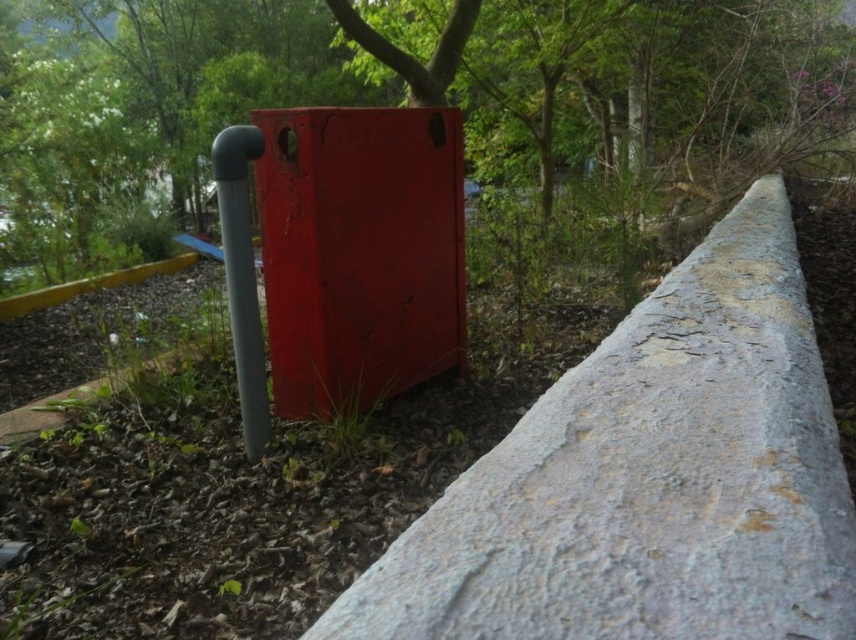
Question: Which of these objects is positioned farthest from the matte gray pipe at center-left?

Choices:
 (A) green leafy tree at upper center
 (B) matte red box at center

Answer: (A)

Question: Does green leafy tree at upper center have a lesser width compared to matte gray pipe at center-left?

Choices:
 (A) yes
 (B) no

Answer: (B)

Question: Does green leafy tree at upper center have a lesser width compared to matte red box at center?

Choices:
 (A) yes
 (B) no

Answer: (B)

Question: Among these points, which one is farthest from the camera?

Choices:
 (A) (107, 134)
 (B) (229, 273)
 (C) (325, 353)

Answer: (A)

Question: Where is matte red box at center located in relation to matte gray pipe at center-left in the image?

Choices:
 (A) left
 (B) right

Answer: (B)

Question: Which of the following is the closest to the observer?

Choices:
 (A) (144, 70)
 (B) (272, 170)
 (C) (236, 134)

Answer: (C)